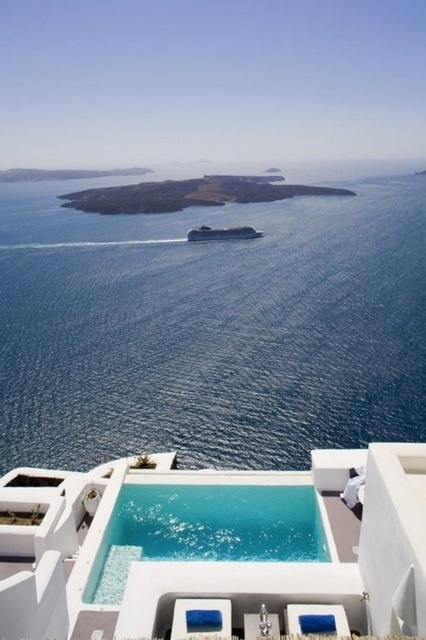
You are a swimmer who wants to jump into the crystal clear glass pool at center. However, you notice the gray rocky island at center nearby. Considering their heights, which one is safer to jump into without hitting anything?

The crystal clear glass pool at center has a lesser height compared to the gray rocky island at center, so it is safer to jump into the crystal clear glass pool at center since it is lower and less likely to cause injury.

You are standing at the edge of the crystal clear glass pool at center. Looking out towards the horizon, what large vessel do you see in the distance?

You see a large cruise ship sailing across the deep blue sea in the midground, leaving a trail of white foam behind it.

You are a guest staying at the coastal resort and want to take a swim. You see the white glossy pool at center and the crystal clear glass pool at center. Which pool is located higher in elevation?

The white glossy pool at center is above the crystal clear glass pool at center, so it is located higher in elevation.